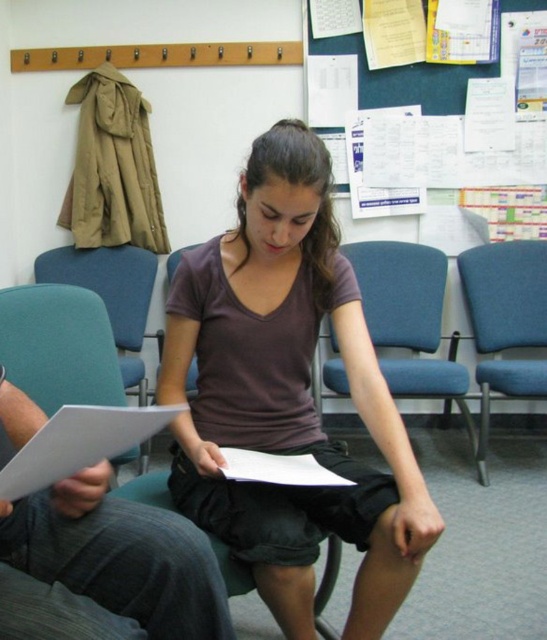
Can you confirm if brown matte shirt at center is smaller than white paper at center?

No.

Does point (246, 180) come behind point (65, 422)?

Yes, point (246, 180) is behind point (65, 422).

I want to click on brown matte shirt at center, so click(288, 396).

In the scene shown: Is blue fabric chair at center wider than blue fabric bulletin board at upper center?

In fact, blue fabric chair at center might be narrower than blue fabric bulletin board at upper center.

Does blue fabric chair at center come behind blue fabric bulletin board at upper center?

No, blue fabric chair at center is in front of blue fabric bulletin board at upper center.

Image resolution: width=547 pixels, height=640 pixels. Identify the location of blue fabric chair at center. (409, 320).

Image resolution: width=547 pixels, height=640 pixels. Find the location of `blue fabric chair at center`. blue fabric chair at center is located at coordinates (409, 320).

Does point (418, 554) come closer to viewer compared to point (508, 321)?

Yes, point (418, 554) is closer to viewer.

Does point (260, 321) lie in front of point (538, 387)?

Yes.

Locate an element on the screen. brown matte shirt at center is located at coordinates (288, 396).